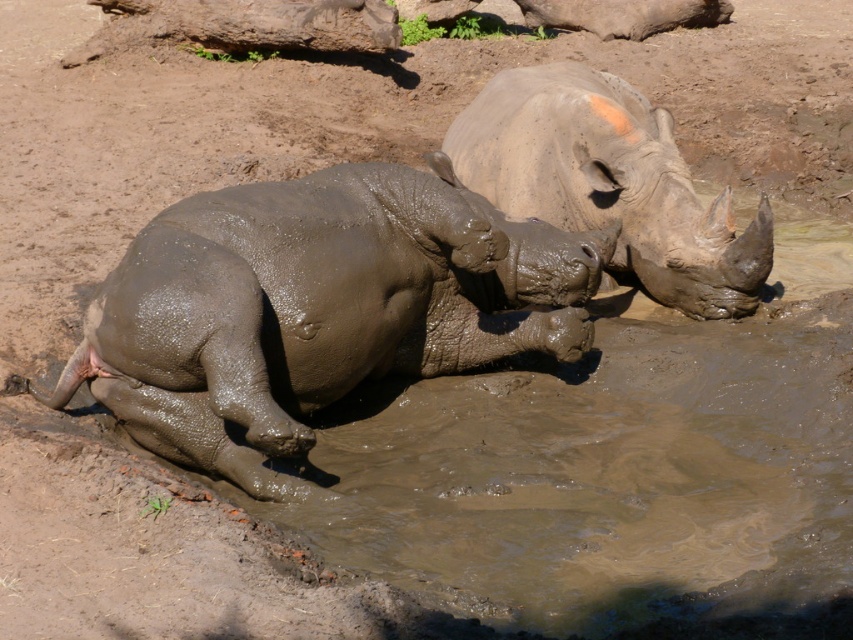
Does muddy gray rhino at left appear under gray matte rhinoceros at upper right?

Yes.

You are a GUI agent. You are given a task and a screenshot of the screen. Output one action in this format:
    pyautogui.click(x=<x>, y=<y>)
    Task: Click on the muddy gray rhino at left
    The width and height of the screenshot is (853, 640).
    Given the screenshot: What is the action you would take?
    pyautogui.click(x=317, y=308)

What do you see at coordinates (317, 308) in the screenshot? I see `muddy gray rhino at left` at bounding box center [317, 308].

The image size is (853, 640). I want to click on muddy gray rhino at left, so click(x=317, y=308).